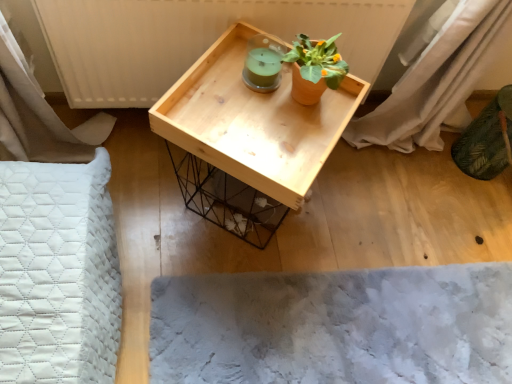
This screenshot has width=512, height=384. In order to click on free spot behind fuzzy gray mat at lower center in this screenshot , I will do coord(389,209).